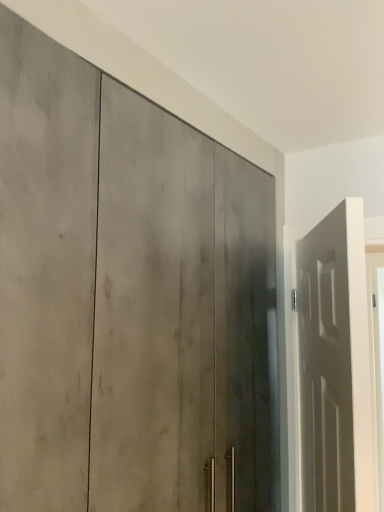
Question: From a real-world perspective, is matte gray door at center, which is counted as the 2th door, starting from the right, above or below white matte door at right, acting as the second door starting from the left?

Choices:
 (A) below
 (B) above

Answer: (B)

Question: Considering the positions of matte gray door at center, acting as the first door starting from the left, and white matte door at right, acting as the second door starting from the left, in the image, is matte gray door at center, acting as the first door starting from the left, taller or shorter than white matte door at right, acting as the second door starting from the left,?

Choices:
 (A) tall
 (B) short

Answer: (A)

Question: From the image's perspective, is matte gray door at center, which is counted as the 2th door, starting from the right, positioned above or below white matte door at right, acting as the second door starting from the left?

Choices:
 (A) below
 (B) above

Answer: (B)

Question: Is point (319, 352) closer or farther from the camera than point (94, 126)?

Choices:
 (A) closer
 (B) farther

Answer: (B)

Question: From their relative heights in the image, would you say white matte door at right, positioned as the first door in right-to-left order, is taller or shorter than matte gray door at center, acting as the first door starting from the left?

Choices:
 (A) short
 (B) tall

Answer: (A)

Question: From the image's perspective, is white matte door at right, positioned as the first door in right-to-left order, above or below matte gray door at center, which is counted as the 2th door, starting from the right?

Choices:
 (A) above
 (B) below

Answer: (B)

Question: Based on their positions, is white matte door at right, positioned as the first door in right-to-left order, located to the left or right of matte gray door at center, acting as the first door starting from the left?

Choices:
 (A) right
 (B) left

Answer: (A)